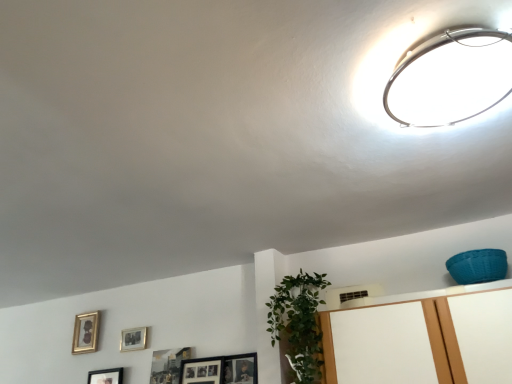
Question: Is green leafy plant at lower center shorter than metallic silver picture frame at lower center, which ranks as the 4th picture frame in left-to-right order?

Choices:
 (A) no
 (B) yes

Answer: (A)

Question: From a real-world perspective, is green leafy plant at lower center located higher than metallic silver picture frame at lower center, which is the first picture frame in right-to-left order?

Choices:
 (A) no
 (B) yes

Answer: (B)

Question: Is green leafy plant at lower center positioned in front of metallic silver picture frame at lower center, which is the first picture frame in right-to-left order?

Choices:
 (A) yes
 (B) no

Answer: (A)

Question: Is green leafy plant at lower center facing away from metallic silver picture frame at lower center, which is the first picture frame in right-to-left order?

Choices:
 (A) no
 (B) yes

Answer: (A)

Question: Does green leafy plant at lower center have a greater height compared to metallic silver picture frame at lower center, which is the first picture frame in right-to-left order?

Choices:
 (A) no
 (B) yes

Answer: (B)

Question: Could you tell me if green leafy plant at lower center is facing metallic silver picture frame at lower center, which is the first picture frame in right-to-left order?

Choices:
 (A) no
 (B) yes

Answer: (A)

Question: Considering the relative positions of matte silver picture frame at upper center, which appears as the second picture frame when viewed from the right, and green leafy plant at lower center in the image provided, is matte silver picture frame at upper center, which appears as the second picture frame when viewed from the right, to the right of green leafy plant at lower center from the viewer's perspective?

Choices:
 (A) yes
 (B) no

Answer: (B)

Question: From a real-world perspective, does matte silver picture frame at upper center, which appears as the second picture frame when viewed from the right, sit lower than green leafy plant at lower center?

Choices:
 (A) yes
 (B) no

Answer: (B)

Question: Considering the relative sizes of matte silver picture frame at upper center, which appears as the second picture frame when viewed from the right, and green leafy plant at lower center in the image provided, is matte silver picture frame at upper center, which appears as the second picture frame when viewed from the right, wider than green leafy plant at lower center?

Choices:
 (A) yes
 (B) no

Answer: (B)

Question: From a real-world perspective, is matte silver picture frame at upper center, which is the third picture frame from left to right, over green leafy plant at lower center?

Choices:
 (A) no
 (B) yes

Answer: (B)

Question: Does matte silver picture frame at upper center, which is the third picture frame from left to right, have a smaller size compared to green leafy plant at lower center?

Choices:
 (A) yes
 (B) no

Answer: (A)

Question: Could you tell me if matte silver picture frame at upper center, which appears as the second picture frame when viewed from the right, is turned towards green leafy plant at lower center?

Choices:
 (A) yes
 (B) no

Answer: (B)

Question: From a real-world perspective, is gold metallic picture frame at lower left, the 4th picture frame in the right-to-left sequence, beneath metallic ring light at upper right?

Choices:
 (A) yes
 (B) no

Answer: (A)